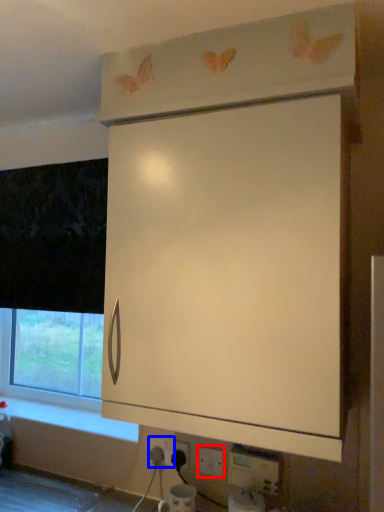
Question: Which of the following is the farthest to the observer, electric outlet (highlighted by a red box) or electric outlet (highlighted by a blue box)?

Choices:
 (A) electric outlet
 (B) electric outlet

Answer: (B)